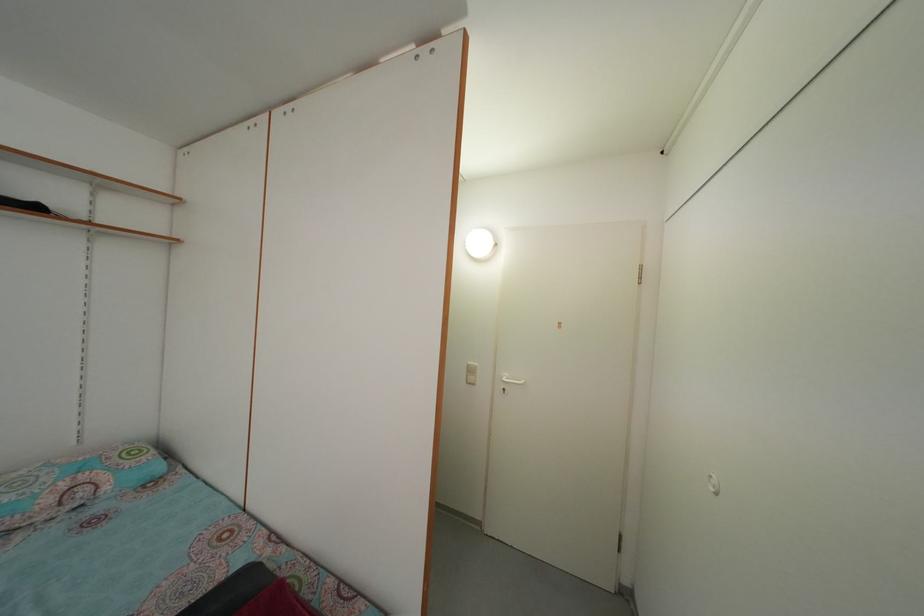
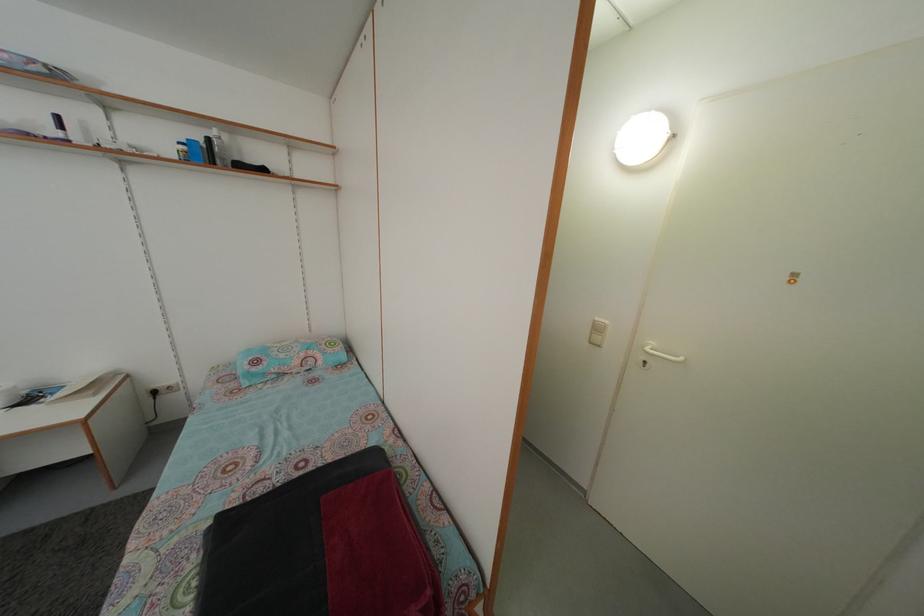
Locate, in the second image, the point that corresponds to [476,371] in the first image.

(602, 326)